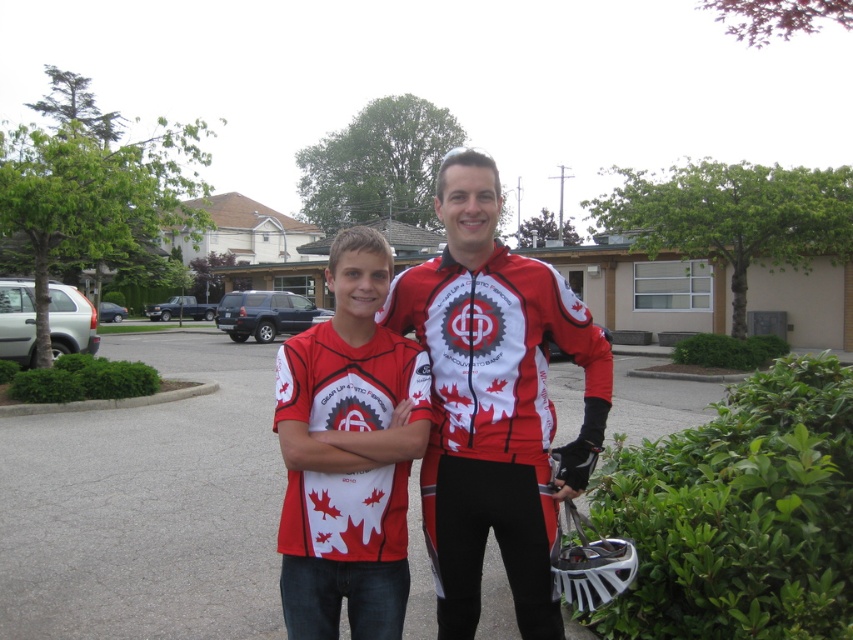
Question: Which of the following is the farthest from the observer?

Choices:
 (A) matte red jersey at center
 (B) matte red cycling jersey at center

Answer: (B)

Question: Is matte red cycling jersey at center to the right of matte red jersey at center from the viewer's perspective?

Choices:
 (A) yes
 (B) no

Answer: (A)

Question: Can you confirm if matte red cycling jersey at center is bigger than matte red jersey at center?

Choices:
 (A) no
 (B) yes

Answer: (B)

Question: In this image, where is matte red cycling jersey at center located relative to matte red jersey at center?

Choices:
 (A) left
 (B) right

Answer: (B)